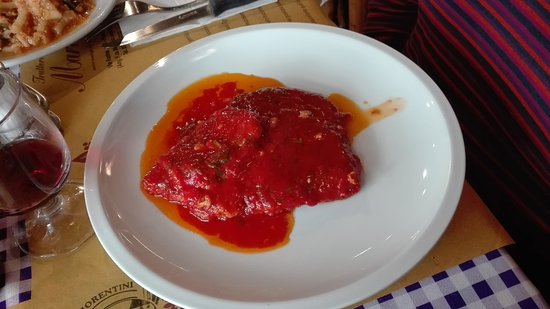
Where is `fork`? This screenshot has height=309, width=550. fork is located at coordinates (140, 8).